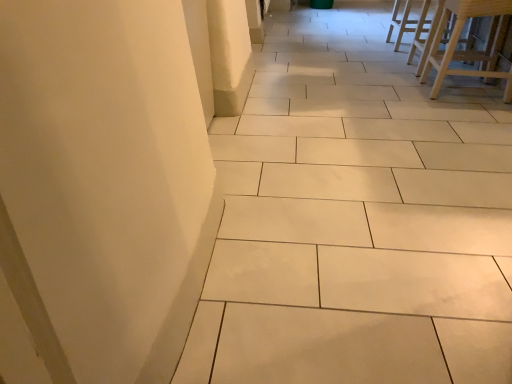
Question: From a real-world perspective, is light wood stool at upper right, arranged as the 2th furniture when viewed from the back, above or below light brown wooden stool at upper right, which appears as the 1th furniture when viewed from the back?

Choices:
 (A) below
 (B) above

Answer: (B)

Question: Does point (441, 21) appear closer or farther from the camera than point (391, 19)?

Choices:
 (A) closer
 (B) farther

Answer: (A)

Question: Looking at their shapes, would you say light wood stool at upper right, the second furniture from the top, is wider or thinner than light brown wooden stool at upper right, which is the second furniture in bottom-to-top order?

Choices:
 (A) thin
 (B) wide

Answer: (B)

Question: From a real-world perspective, is light brown wooden stool at upper right, which is the second furniture in bottom-to-top order, physically located above or below light wood stool at upper right, which is the 1th furniture from front to back?

Choices:
 (A) below
 (B) above

Answer: (A)

Question: Considering the positions of point (396, 3) and point (485, 56), is point (396, 3) closer or farther from the camera than point (485, 56)?

Choices:
 (A) closer
 (B) farther

Answer: (B)

Question: Based on their positions, is light brown wooden stool at upper right, arranged as the 2th furniture when viewed from the front, located to the left or right of light wood stool at upper right, the second furniture from the top?

Choices:
 (A) left
 (B) right

Answer: (B)

Question: In the image, is light brown wooden stool at upper right, arranged as the 2th furniture when viewed from the front, positioned in front of or behind light wood stool at upper right, the second furniture from the top?

Choices:
 (A) front
 (B) behind

Answer: (B)